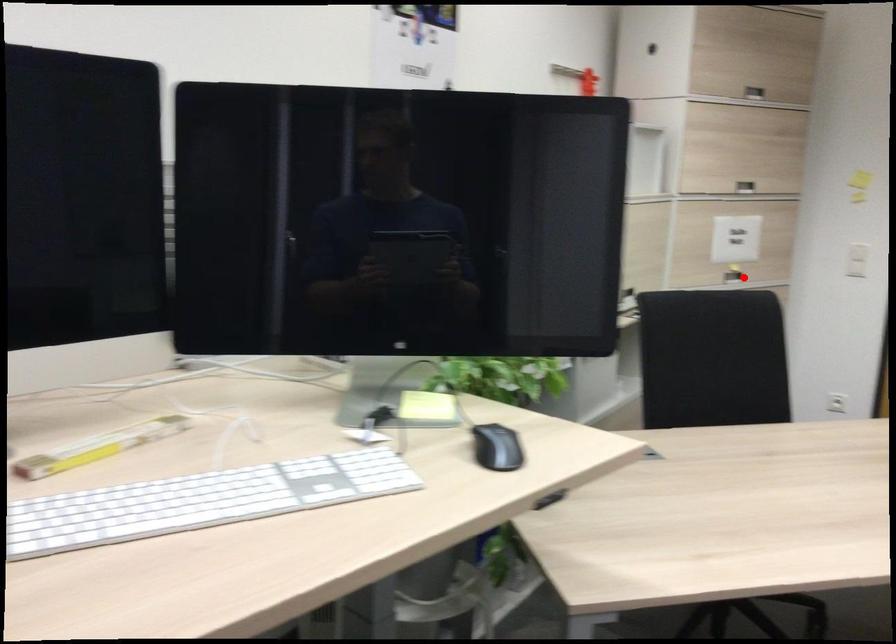
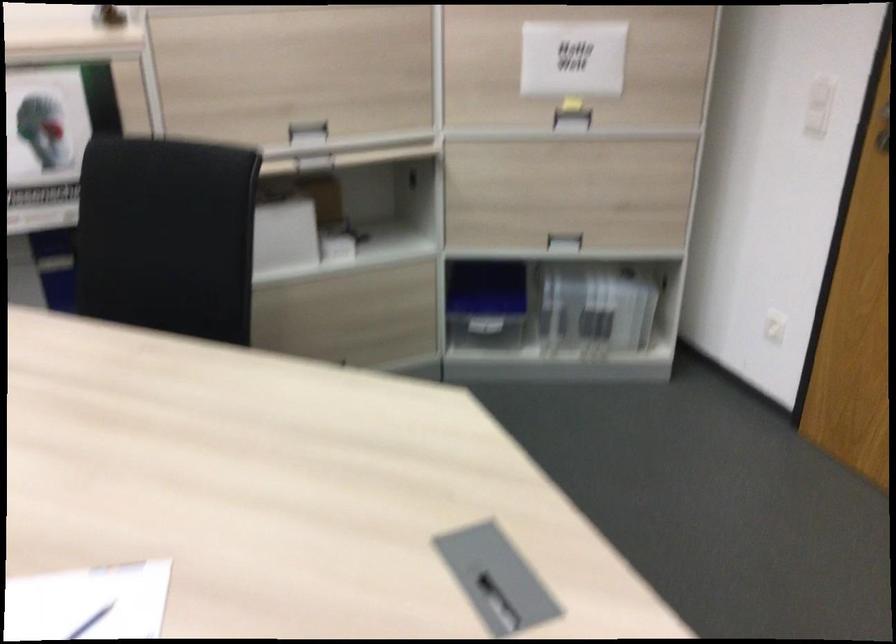
Find the pixel in the second image that matches the highlighted location in the first image.

(572, 120)